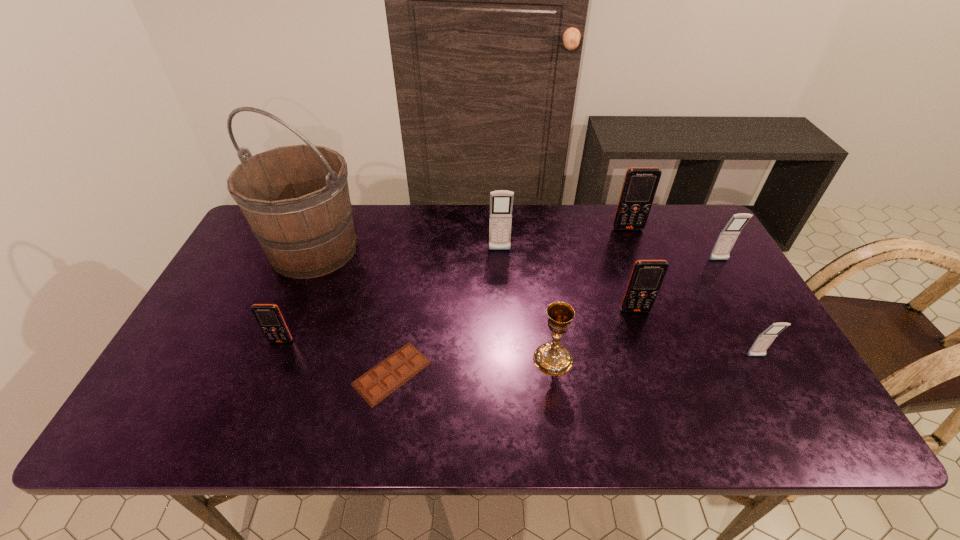
Where is `the fifth object from right to left`? Image resolution: width=960 pixels, height=540 pixels. the fifth object from right to left is located at coordinates (553, 359).

You are a GUI agent. You are given a task and a screenshot of the screen. Output one action in this format:
    pyautogui.click(x=<x>, y=<y>)
    Task: Click on the fifth farthest cellular telephone
    This screenshot has height=540, width=960.
    Given the screenshot: What is the action you would take?
    pyautogui.click(x=268, y=316)

Identify the location of the leftmost cellular telephone. (268, 316).

Identify the location of the nearest gray cellular telephone. Image resolution: width=960 pixels, height=540 pixels. (764, 340).

Locate an element on the screen. Image resolution: width=960 pixels, height=540 pixels. the smallest gray cellular telephone is located at coordinates (764, 340).

Locate an element on the screen. chocolate bar is located at coordinates (383, 379).

Image resolution: width=960 pixels, height=540 pixels. Identify the location of the third object from left to right. (383, 379).

At what (x,y) coordinates should I click in order to perform the action: click on vacant space located on the front of the brown bucket. Please return your answer as a coordinate pair (x, y). Image resolution: width=960 pixels, height=540 pixels. Looking at the image, I should click on (257, 385).

Locate an element on the screen. The image size is (960, 540). vacant space located on the front-facing side of the biggest gray cellular telephone is located at coordinates (504, 342).

The image size is (960, 540). In order to click on free space located 0.370m on the screen of the farthest cellular telephone in this screenshot , I will do `click(663, 319)`.